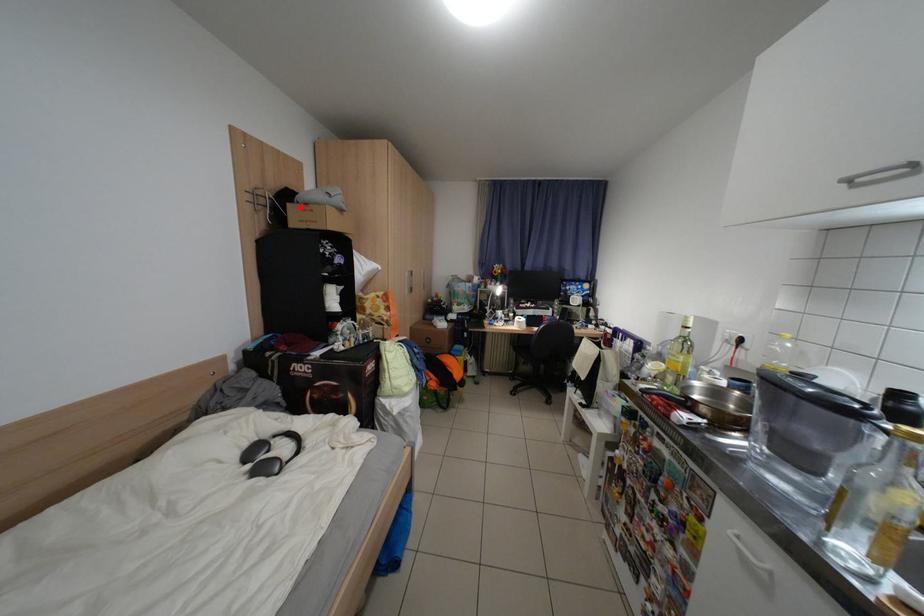
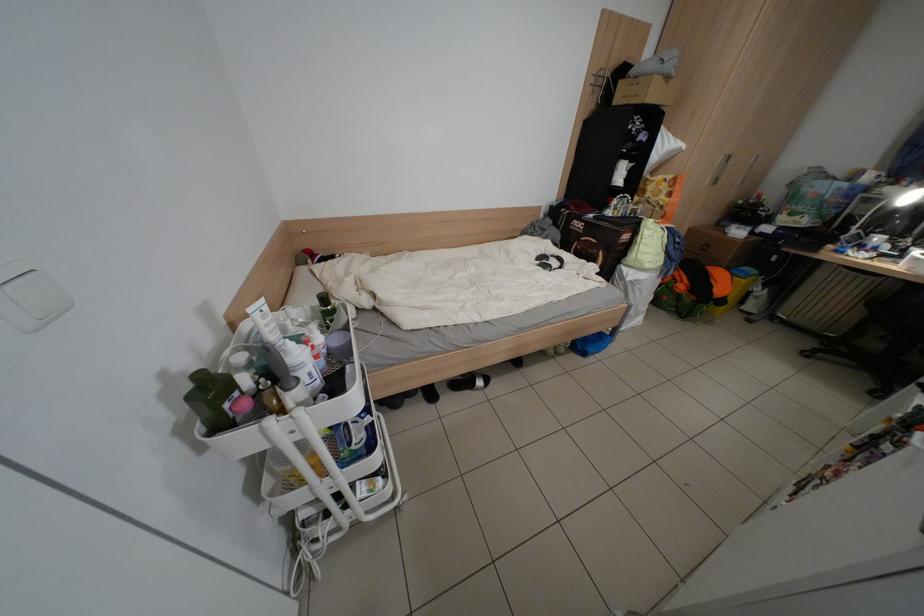
The point at the highlighted location is marked in the first image. Where is the corresponding point in the second image?

(631, 83)